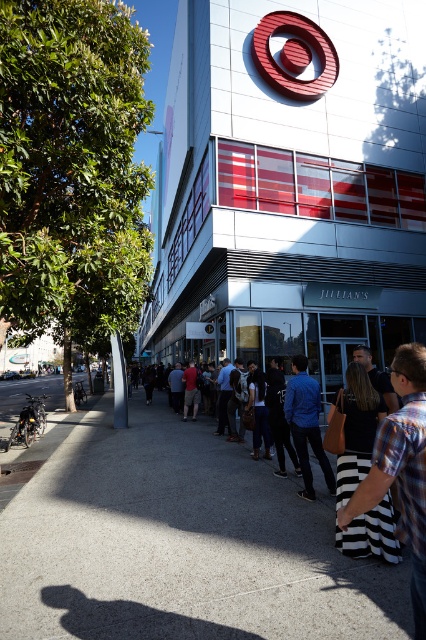
You are standing in front of the Target store and need to reach both the point at coordinates point (37, 588) and point (351, 522). Which point will you reach first as you move forward?

You will reach point (37, 588) first because it is closer to you than point (351, 522), which is further away.

You are standing in front of the Target store and see a denim jacket at center and a red shirt at center. Which clothing item is positioned to the right of the other?

The denim jacket at center is to the right of the red shirt at center.

You are standing in front of the Target store and want to hand a flyer to the person wearing the striped fabric skirt at lower right and the denim jacket at center. Which one can you reach first without moving from your current position?

The striped fabric skirt at lower right is closer to the viewer than the denim jacket at center, so you can reach the person wearing the striped fabric skirt at lower right first without moving.